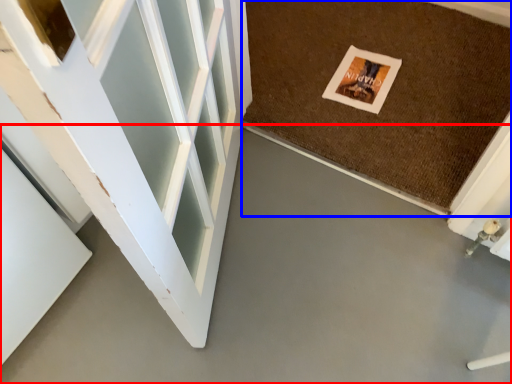
Question: Which object appears closest to the camera in this image, concrete (highlighted by a red box) or mat (highlighted by a blue box)?

Choices:
 (A) concrete
 (B) mat

Answer: (A)